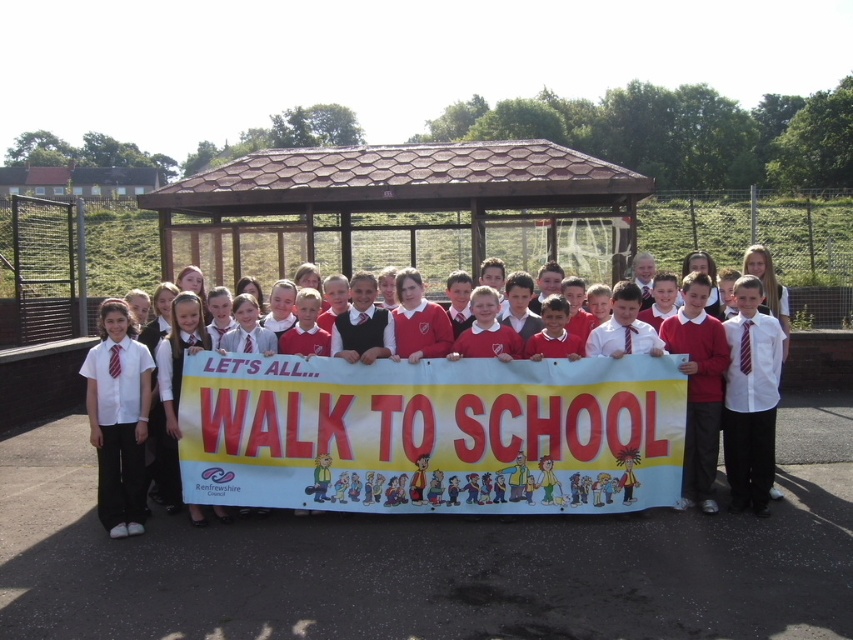
Is white shirt at left closer to camera compared to white shirt with tie at right?

That is True.

Does point (144, 490) come farther from viewer compared to point (756, 369)?

No, it is in front of (756, 369).

This screenshot has height=640, width=853. What do you see at coordinates (119, 426) in the screenshot?
I see `white shirt at left` at bounding box center [119, 426].

Where is `white shirt at left`? white shirt at left is located at coordinates (119, 426).

Based on the photo, between white paper banner at center and white shirt with tie at right, which one appears on the left side from the viewer's perspective?

From the viewer's perspective, white paper banner at center appears more on the left side.

Where is `white paper banner at center`? Image resolution: width=853 pixels, height=640 pixels. white paper banner at center is located at coordinates (432, 435).

Between point (416, 468) and point (747, 493), which one is positioned behind?

The point (747, 493) is more distant.

Find the location of a particular element. This screenshot has width=853, height=640. white paper banner at center is located at coordinates (432, 435).

Is white glossy shirt at center above white shirt at left?

Yes, white glossy shirt at center is above white shirt at left.

Is point (643, 493) farther from camera compared to point (102, 387)?

Yes, it is behind point (102, 387).

Where is `white glossy shirt at center`? The image size is (853, 640). white glossy shirt at center is located at coordinates (454, 424).